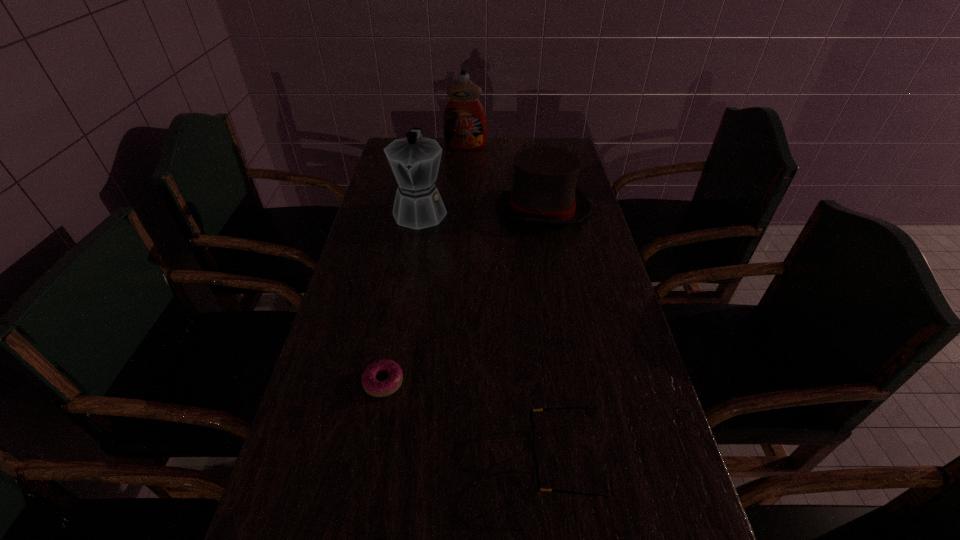
The width and height of the screenshot is (960, 540). In order to click on free region at the left edge of the desktop in this screenshot , I will do `click(396, 302)`.

Where is `free point at the right edge`? Image resolution: width=960 pixels, height=540 pixels. free point at the right edge is located at coordinates (668, 490).

The width and height of the screenshot is (960, 540). Identify the location of vacant region between the doughnut and the dress hat. (463, 295).

Locate an element on the screen. Image resolution: width=960 pixels, height=540 pixels. vacant space in between the doughnut and the detergent is located at coordinates (424, 265).

Identify the location of empty location between the second nearest object and the third shortest object. pyautogui.click(x=463, y=295).

I want to click on free area in between the third tallest object and the nearest object, so click(554, 334).

You are a GUI agent. You are given a task and a screenshot of the screen. Output one action in this format:
    pyautogui.click(x=<x>, y=<y>)
    Task: Click on the empty space between the nearest object and the coffeepot
    
    Given the screenshot: What is the action you would take?
    pyautogui.click(x=492, y=335)

At what (x,y) coordinates should I click in order to perform the action: click on empty location between the coffeepot and the spectacles. Please return your answer as a coordinate pair (x, y). The height and width of the screenshot is (540, 960). Looking at the image, I should click on (492, 335).

Locate an element on the screen. The width and height of the screenshot is (960, 540). free space between the spectacles and the third shortest object is located at coordinates (x=554, y=334).

Select which object is the third closest to the second nearest object. Please provide its 2D coordinates. Your answer should be formatted as a tuple, i.e. [(x, y)], where the tuple contains the x and y coordinates of a point satisfying the conditions above.

[(544, 190)]